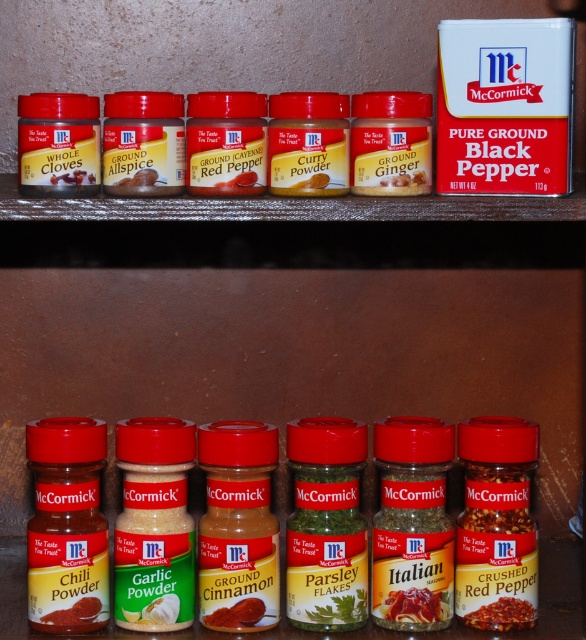
Question: Estimate the real-world distances between objects in this image. Which object is farther from the red matte chili powder at lower left?

Choices:
 (A) red matte ground red pepper at center
 (B) yellowish matte garlic powder at center
 (C) yellowish-brown powder ginger at center

Answer: (C)

Question: In this image, where is red matte crushed red pepper at center located relative to red matte chili powder at lower left?

Choices:
 (A) right
 (B) left

Answer: (A)

Question: Which of the following is the farthest from the observer?

Choices:
 (A) red matte spice bottles at center
 (B) ground allspice at center

Answer: (B)

Question: Is whole cloves at upper left bigger than red matte ground red pepper at center?

Choices:
 (A) no
 (B) yes

Answer: (B)

Question: From the image, what is the correct spatial relationship of ground cinnamon at center in relation to red matte chili powder at lower left?

Choices:
 (A) above
 (B) below

Answer: (B)

Question: Which object is farther from the camera taking this photo?

Choices:
 (A) whole cloves at upper left
 (B) yellowish matte garlic powder at center

Answer: (A)